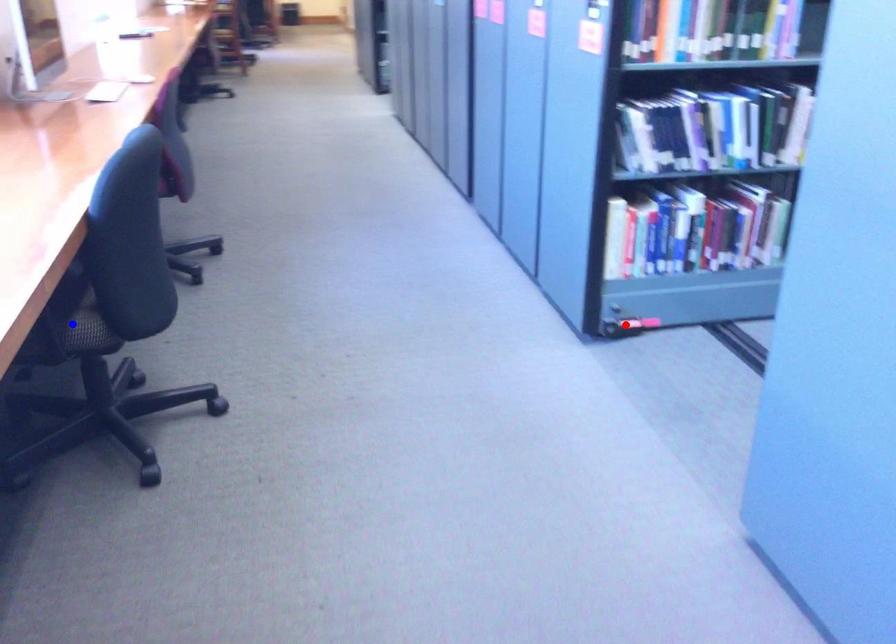
Question: Two points are marked on the image. Which point is closer to the camera?

Choices:
 (A) Blue point is closer.
 (B) Red point is closer.

Answer: (A)